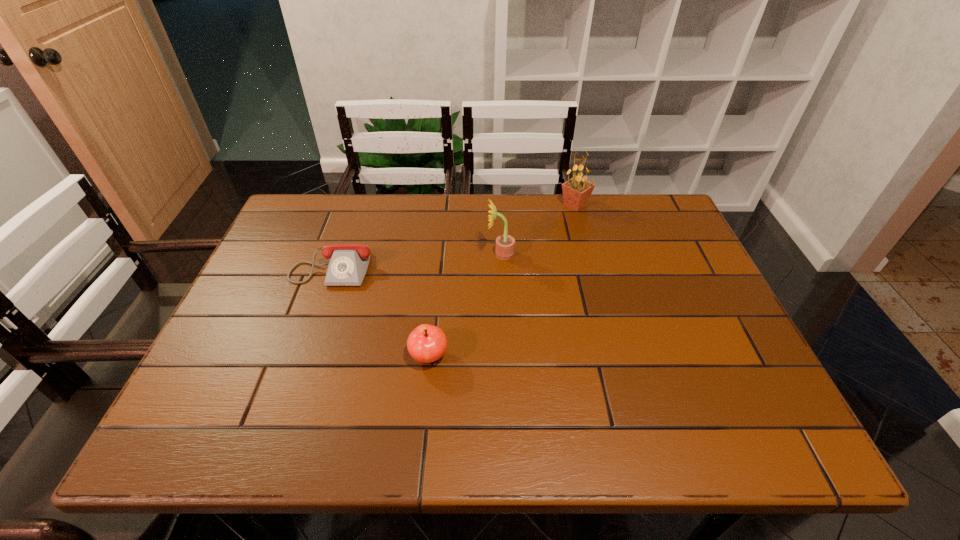
Locate an element on the screen. vacant position located 0.080m at the front of the farther sunflower with flowers visible is located at coordinates (533, 205).

Locate an element on the screen. vacant space located 0.240m on the face of the left sunflower is located at coordinates (399, 254).

Find the location of a particular element. This screenshot has width=960, height=540. blank space located 0.340m on the face of the left sunflower is located at coordinates (363, 254).

This screenshot has height=540, width=960. I want to click on free space located on the face of the left sunflower, so click(414, 254).

This screenshot has width=960, height=540. I want to click on free point located 0.180m on the back of the third object from right to left, so click(x=436, y=285).

Locate an element on the screen. This screenshot has width=960, height=540. vacant space situated on the dial of the telephone is located at coordinates (313, 321).

In order to click on object present at the far edge in this screenshot , I will do `click(576, 191)`.

Find the location of a particular element. The image size is (960, 540). object that is at the left edge is located at coordinates (348, 264).

At what (x,y) coordinates should I click in order to perform the action: click on vacant space at the far edge. Please return your answer as a coordinate pair (x, y). Looking at the image, I should click on (465, 195).

The width and height of the screenshot is (960, 540). In the image, there is a desktop. In order to click on vacant space at the left edge in this screenshot , I will do `click(267, 254)`.